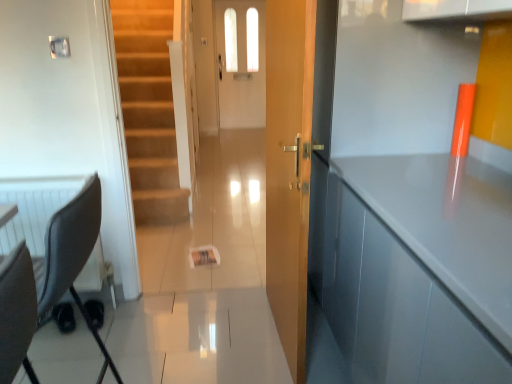
Question: Is black fabric swivel chair at left wider or thinner than wooden door at center?

Choices:
 (A) thin
 (B) wide

Answer: (B)

Question: Is point (67, 231) closer or farther from the camera than point (307, 206)?

Choices:
 (A) farther
 (B) closer

Answer: (B)

Question: Based on their relative distances, which object is nearer to the glossy gray cabinet at right?

Choices:
 (A) white glossy door at center
 (B) black fabric swivel chair at left
 (C) wooden door at center

Answer: (C)

Question: Considering the real-world distances, which object is closest to the black fabric swivel chair at left?

Choices:
 (A) glossy gray cabinet at right
 (B) white glossy door at center
 (C) wooden door at center

Answer: (C)